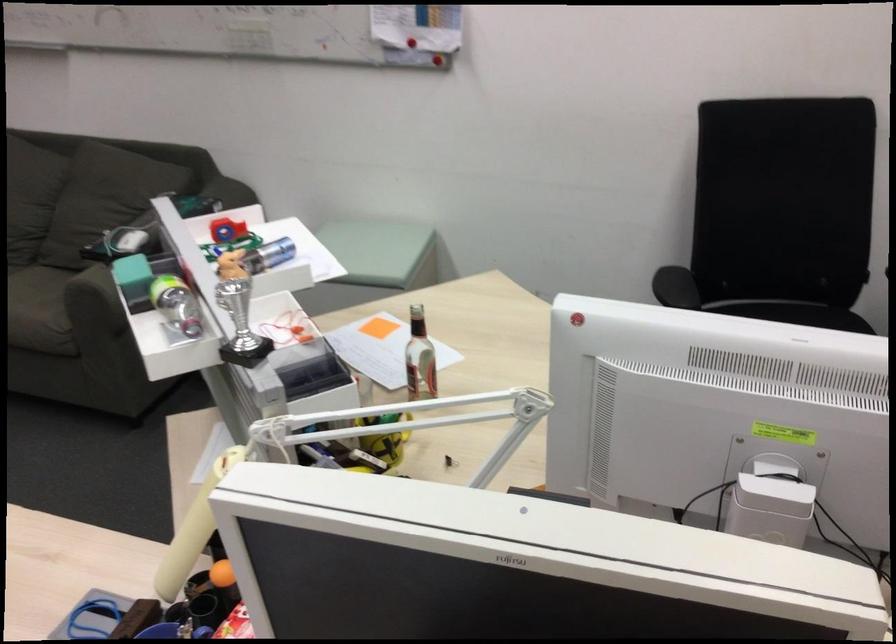
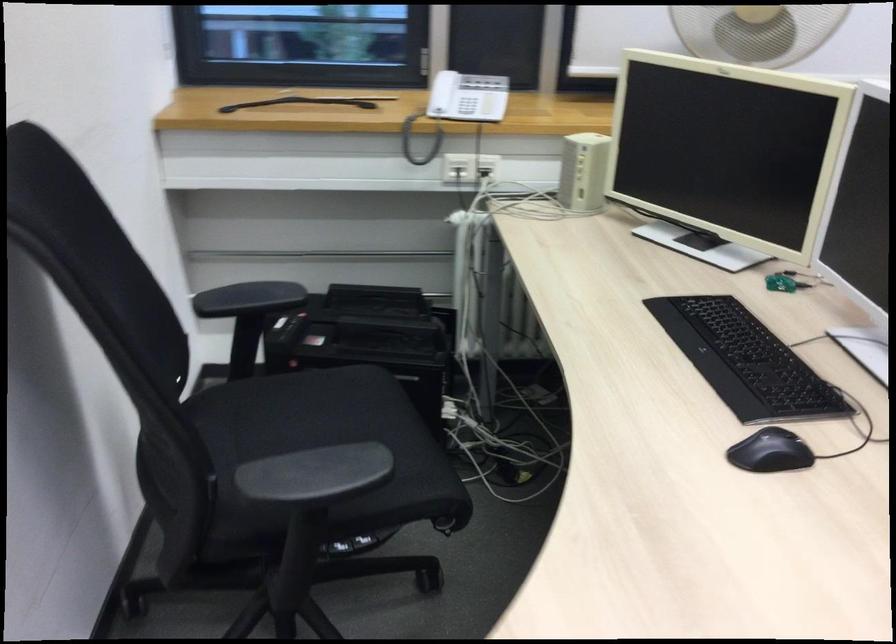
Find the pixel in the second image that matches (x=673, y=283) in the first image.

(315, 475)